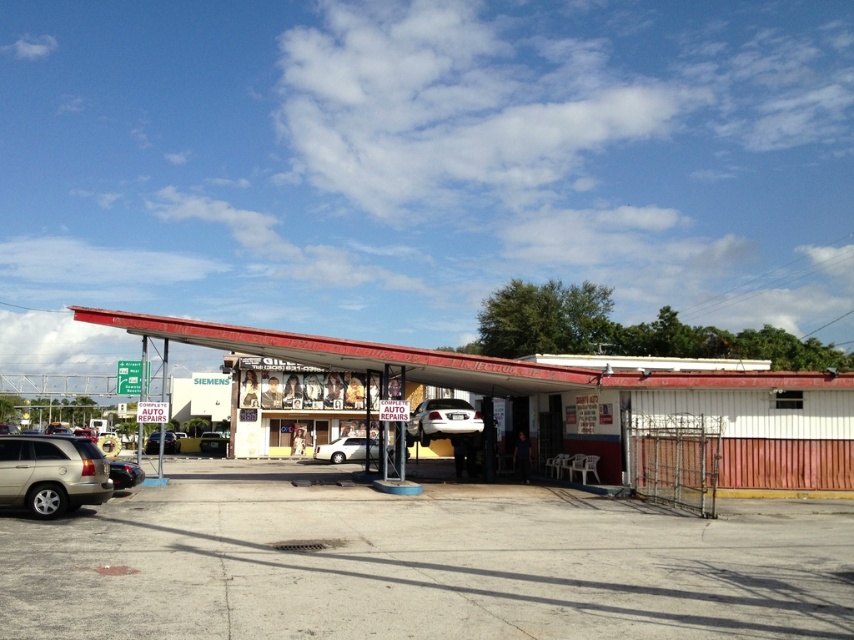
Question: Which point appears closest to the camera in this image?

Choices:
 (A) (20, 476)
 (B) (840, 474)
 (C) (337, 442)
 (D) (118, 467)

Answer: (A)

Question: Which point is farther to the camera?

Choices:
 (A) gold metallic suv at lower left
 (B) white glossy car at center
 (C) white matte sedan at center
 (D) red corrugated metal awning at center

Answer: (B)

Question: Among these objects, which one is farthest from the camera?

Choices:
 (A) white glossy car at center
 (B) white matte sedan at center
 (C) gold metallic suv at lower left
 (D) matte black car at center

Answer: (D)

Question: Is gold metallic suv at lower left closer to the viewer compared to white matte sedan at center?

Choices:
 (A) no
 (B) yes

Answer: (B)

Question: Is red corrugated metal awning at center thinner than white matte sedan at center?

Choices:
 (A) no
 (B) yes

Answer: (A)

Question: Is gold metallic suv at lower left below matte black car at center?

Choices:
 (A) no
 (B) yes

Answer: (A)